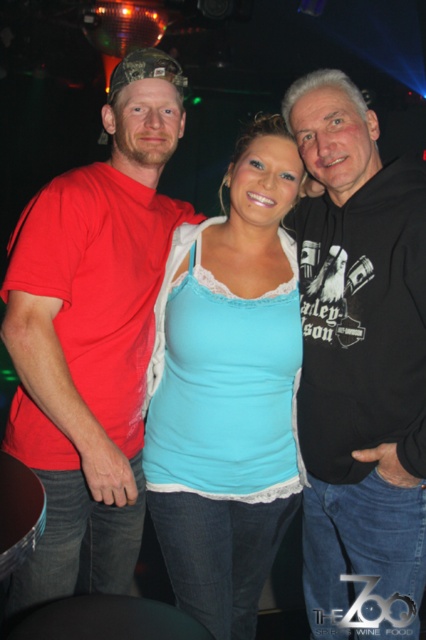
Is black hoodie at right in front of light blue fabric tank top at center?

That is True.

What do you see at coordinates (359, 365) in the screenshot? I see `black hoodie at right` at bounding box center [359, 365].

I want to click on black hoodie at right, so click(359, 365).

Consider the image. Can you confirm if matte red t-shirt at left is positioned to the left of light blue fabric tank top at center?

Indeed, matte red t-shirt at left is positioned on the left side of light blue fabric tank top at center.

Can you confirm if matte red t-shirt at left is thinner than light blue fabric tank top at center?

In fact, matte red t-shirt at left might be wider than light blue fabric tank top at center.

Who is more distant from viewer, [118,435] or [249,435]?

Positioned behind is point [118,435].

Where is `matte red t-shirt at left`? matte red t-shirt at left is located at coordinates (92, 336).

Between black hoodie at right and matte red t-shirt at left, which one appears on the left side from the viewer's perspective?

From the viewer's perspective, matte red t-shirt at left appears more on the left side.

Is black hoodie at right wider than matte red t-shirt at left?

No, black hoodie at right is not wider than matte red t-shirt at left.

Is point (313, 593) closer to camera compared to point (108, 544)?

No, (313, 593) is further to viewer.

You are a GUI agent. You are given a task and a screenshot of the screen. Output one action in this format:
    pyautogui.click(x=<x>, y=<y>)
    Task: Click on the black hoodie at right
    The height and width of the screenshot is (640, 426).
    Given the screenshot: What is the action you would take?
    pyautogui.click(x=359, y=365)